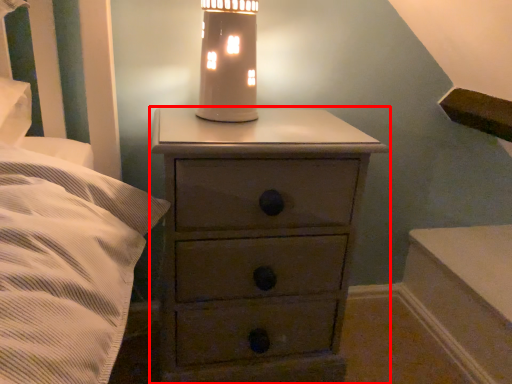
Question: Considering the relative positions of chest of drawers (annotated by the red box) and oil lamp in the image provided, where is chest of drawers (annotated by the red box) located with respect to the staircase?

Choices:
 (A) left
 (B) right

Answer: (B)